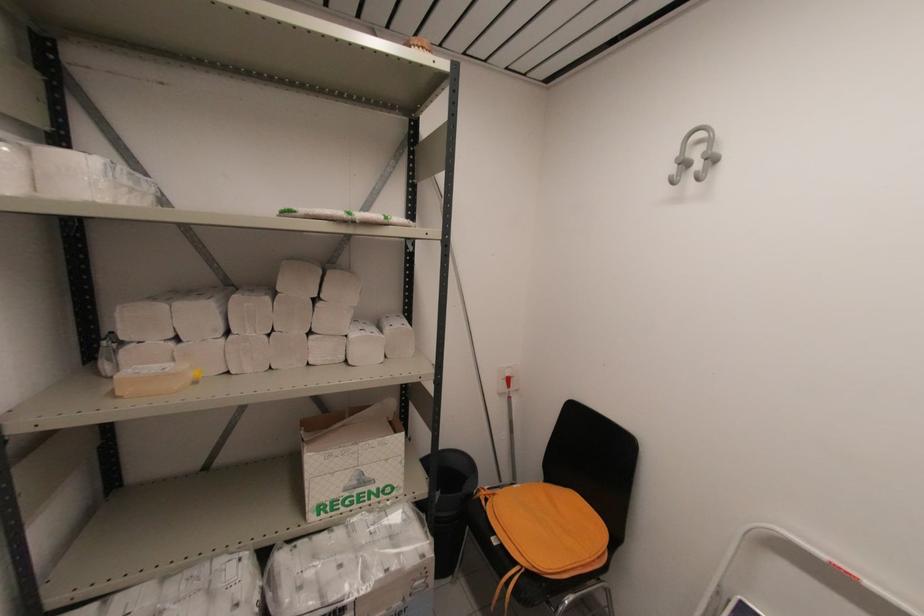
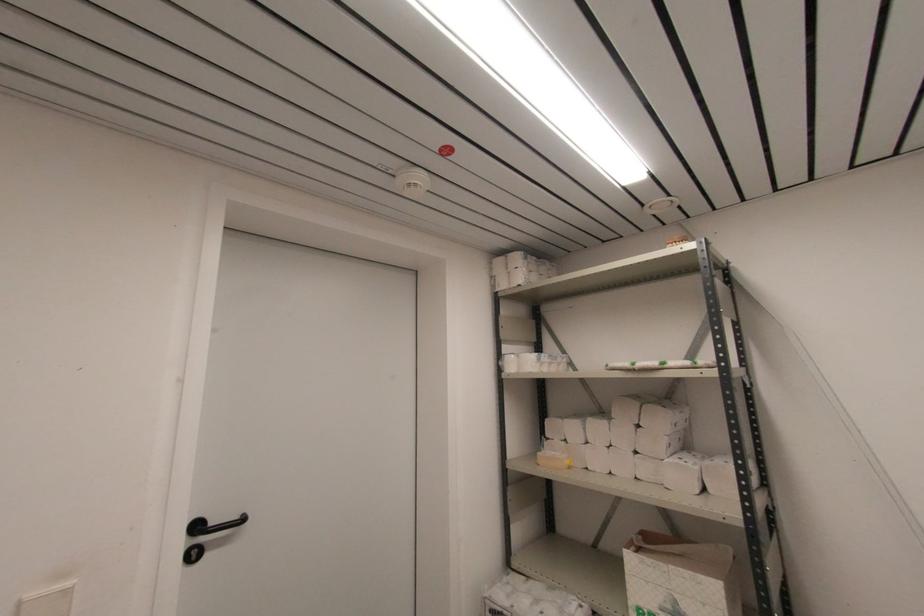
The point at (356, 483) is marked in the first image. Where is the corresponding point in the second image?

(671, 609)